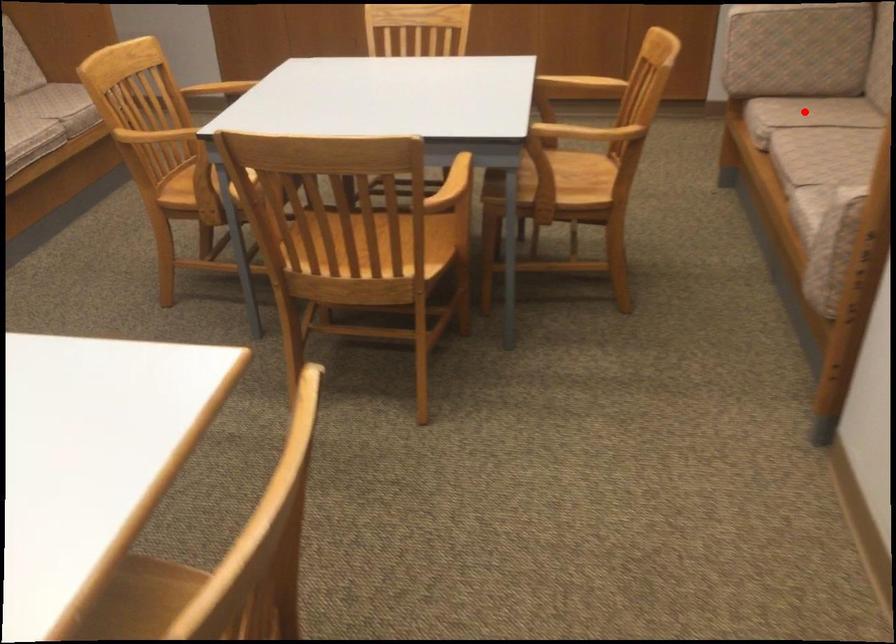
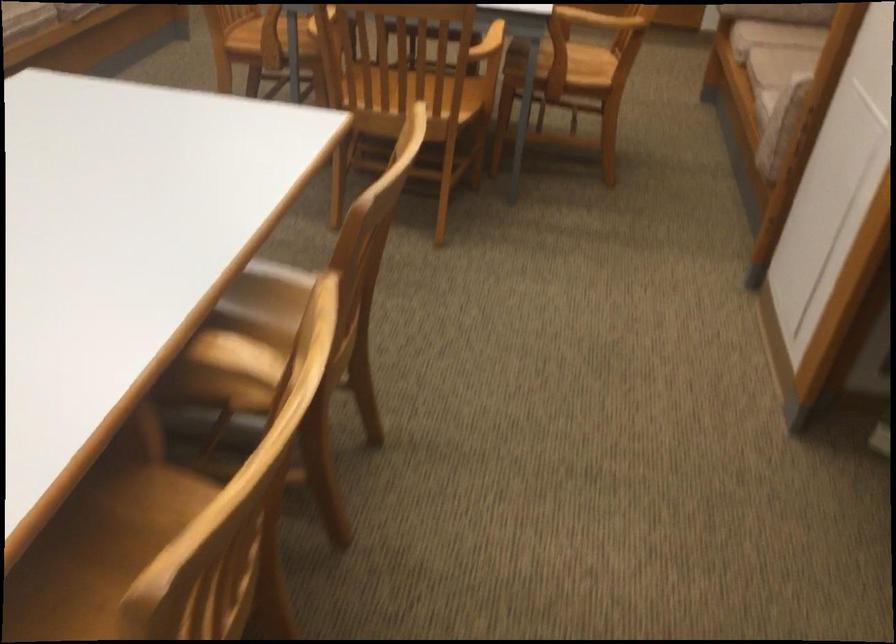
Question: A red point is marked in image1. In image2, is the corresponding 3D point closer to the camera or farther? Reply with the corresponding letter.

Choices:
 (A) The corresponding 3D point is closer.
 (B) The corresponding 3D point is farther.

Answer: (B)